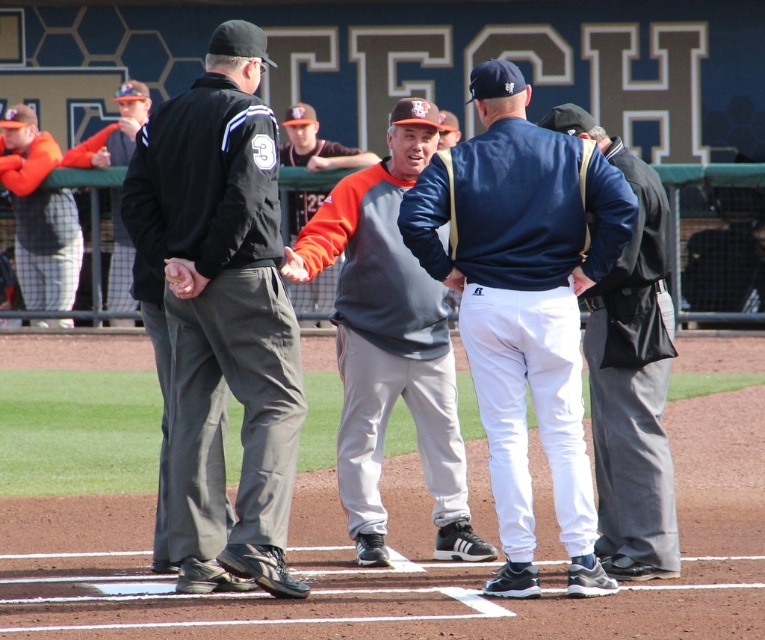
Which is more to the right, dark blue jacket at center or orange mesh pants at left?

From the viewer's perspective, dark blue jacket at center appears more on the right side.

Can you confirm if dark blue jacket at center is thinner than orange mesh pants at left?

Indeed, dark blue jacket at center has a lesser width compared to orange mesh pants at left.

Find the location of a particular element. The image size is (765, 640). dark blue jacket at center is located at coordinates (630, 374).

Which is below, black fabric jacket at left or orange fabric jacket at center?

black fabric jacket at left is lower down.

Is black fabric jacket at left positioned in front of orange fabric jacket at center?

Yes, it is.

Locate an element on the screen. black fabric jacket at left is located at coordinates (223, 316).

Between white cotton pants at center and orange fabric jacket at center, which one is positioned lower?

Positioned lower is white cotton pants at center.

Does white cotton pants at center have a larger size compared to orange fabric jacket at center?

Actually, white cotton pants at center might be smaller than orange fabric jacket at center.

You are a GUI agent. You are given a task and a screenshot of the screen. Output one action in this format:
    pyautogui.click(x=<x>, y=<y>)
    Task: Click on the white cotton pants at center
    This screenshot has width=765, height=640.
    Given the screenshot: What is the action you would take?
    pyautogui.click(x=523, y=305)